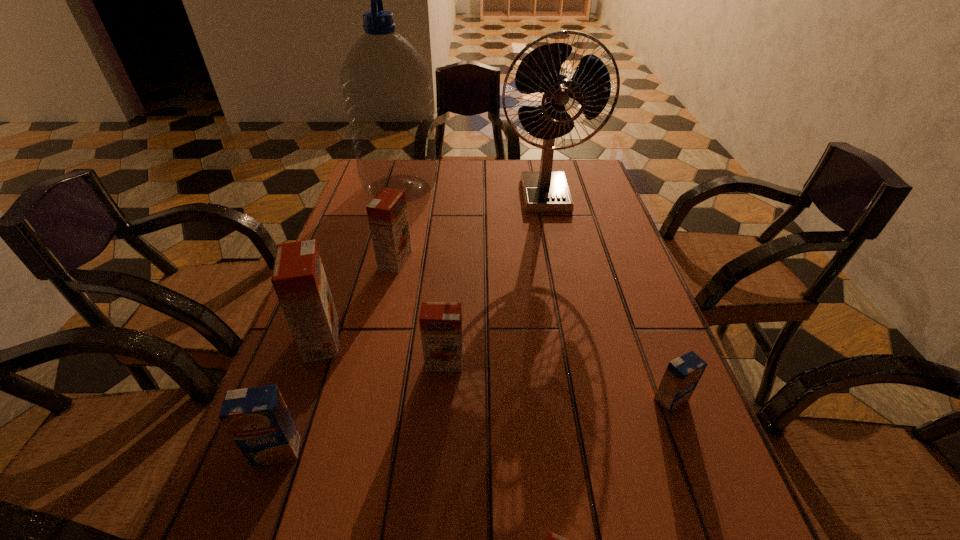
At what (x,y) coordinates should I click in order to perform the action: click on empty location between the third nearest object and the biggest orange orange juice. Please return your answer as a coordinate pair (x, y). Looking at the image, I should click on (496, 370).

Locate an element on the screen. The width and height of the screenshot is (960, 540). free spot between the blue fan and the second nearest object is located at coordinates (411, 323).

Where is `vacant area that lies between the fourth object from right to left and the fan`? Image resolution: width=960 pixels, height=540 pixels. vacant area that lies between the fourth object from right to left and the fan is located at coordinates (495, 280).

Locate an element on the screen. The image size is (960, 540). object that stands as the second closest to the fourth orange juice from left to right is located at coordinates (258, 420).

At what (x,y) coordinates should I click in order to perform the action: click on object that stands as the closest to the farther blue orange_juice. Please return your answer as a coordinate pair (x, y). Image resolution: width=960 pixels, height=540 pixels. Looking at the image, I should click on (552, 539).

Where is `orange juice that is the nearest to the left blue orange_juice`? orange juice that is the nearest to the left blue orange_juice is located at coordinates (299, 280).

Identify which orange juice is the third nearest to the farther blue orange_juice. Please provide its 2D coordinates. Your answer should be formatted as a tuple, i.e. [(x, y)], where the tuple contains the x and y coordinates of a point satisfying the conditions above.

[(387, 213)]

Where is `the third closest orange orange juice to the bigger blue orange_juice`? the third closest orange orange juice to the bigger blue orange_juice is located at coordinates (552, 539).

You are a GUI agent. You are given a task and a screenshot of the screen. Output one action in this format:
    pyautogui.click(x=<x>, y=<y>)
    Task: Click on the orange orange juice that is the second closest to the farther blue orange_juice
    Image resolution: width=960 pixels, height=540 pixels.
    Given the screenshot: What is the action you would take?
    pyautogui.click(x=440, y=323)

This screenshot has height=540, width=960. I want to click on vacant space that satisfies the following two spatial constraints: 1. on the back side of the blue water jug; 2. on the left side of the leftmost orange orange juice, so click(375, 188).